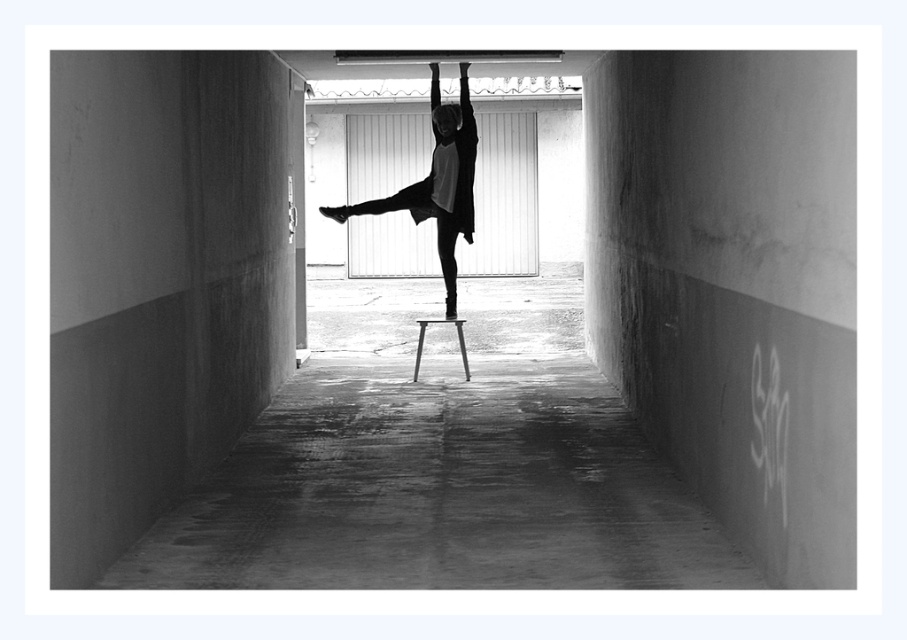
Can you confirm if matte black dress at center is positioned to the left of metallic silver stool at center?

Correct, you'll find matte black dress at center to the left of metallic silver stool at center.

Looking at this image, who is more forward, (466, 141) or (418, 321)?

Point (466, 141)

At what (x,y) coordinates should I click in order to perform the action: click on matte black dress at center. Please return your answer as a coordinate pair (x, y). Looking at the image, I should click on (437, 182).

Which is more to the right, concrete floor at center or matte black dress at center?

concrete floor at center is more to the right.

Find the location of a particular element. The image size is (907, 640). concrete floor at center is located at coordinates (733, 284).

Image resolution: width=907 pixels, height=640 pixels. What do you see at coordinates (733, 284) in the screenshot?
I see `concrete floor at center` at bounding box center [733, 284].

Is point (208, 131) farther from camera compared to point (461, 342)?

No, (208, 131) is in front of (461, 342).

Describe the element at coordinates (733, 284) in the screenshot. I see `concrete floor at center` at that location.

Image resolution: width=907 pixels, height=640 pixels. What are the coordinates of `concrete floor at center` in the screenshot? It's located at (733, 284).